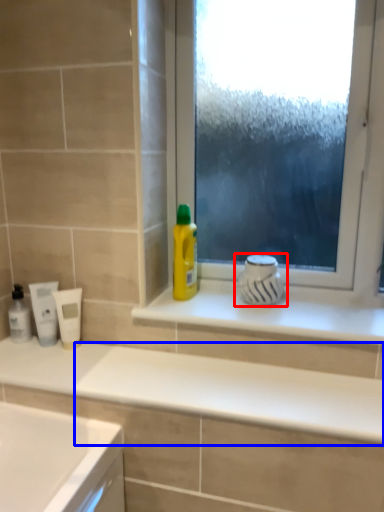
Question: Among these objects, which one is farthest to the camera, appliance (highlighted by a red box) or counter top (highlighted by a blue box)?

Choices:
 (A) appliance
 (B) counter top

Answer: (A)